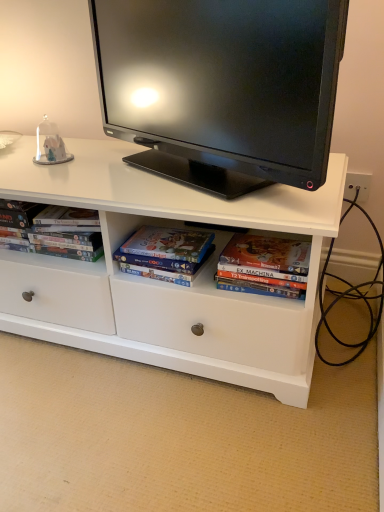
Question: Is the position of matte cardboard book at center more distant than that of matte black dvd case at left?

Choices:
 (A) yes
 (B) no

Answer: (B)

Question: Is matte cardboard book at center not within matte black dvd case at left?

Choices:
 (A) no
 (B) yes

Answer: (B)

Question: Can you confirm if matte cardboard book at center is positioned to the right of matte black dvd case at left?

Choices:
 (A) no
 (B) yes

Answer: (B)

Question: From the image's perspective, would you say matte cardboard book at center is shown under matte black dvd case at left?

Choices:
 (A) no
 (B) yes

Answer: (B)

Question: From a real-world perspective, is matte cardboard book at center located beneath matte black dvd case at left?

Choices:
 (A) yes
 (B) no

Answer: (A)

Question: Is matte cardboard book at center positioned with its back to matte black dvd case at left?

Choices:
 (A) yes
 (B) no

Answer: (B)

Question: Is matte black dvd case at left to the right of black glossy tv at upper center from the viewer's perspective?

Choices:
 (A) no
 (B) yes

Answer: (A)

Question: Considering the relative sizes of matte black dvd case at left and black glossy tv at upper center in the image provided, is matte black dvd case at left taller than black glossy tv at upper center?

Choices:
 (A) no
 (B) yes

Answer: (A)

Question: Would you say matte black dvd case at left contains black glossy tv at upper center?

Choices:
 (A) no
 (B) yes

Answer: (A)

Question: Considering the relative positions of matte black dvd case at left and black glossy tv at upper center in the image provided, is matte black dvd case at left in front of black glossy tv at upper center?

Choices:
 (A) yes
 (B) no

Answer: (B)

Question: Could you tell me if matte black dvd case at left is turned towards black glossy tv at upper center?

Choices:
 (A) yes
 (B) no

Answer: (B)

Question: Is matte black dvd case at left not inside black glossy tv at upper center?

Choices:
 (A) no
 (B) yes

Answer: (B)

Question: From the image's perspective, does matte black dvd case at left appear higher than matte cardboard book at center?

Choices:
 (A) yes
 (B) no

Answer: (A)